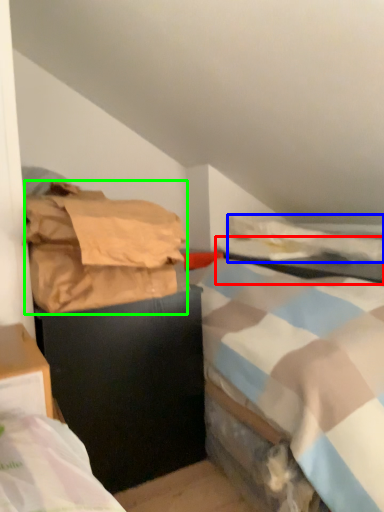
Question: Estimate the real-world distances between objects in this image. Which object is closer to table (highlighted by a red box), blanket (highlighted by a blue box) or material (highlighted by a green box)?

Choices:
 (A) blanket
 (B) material

Answer: (A)